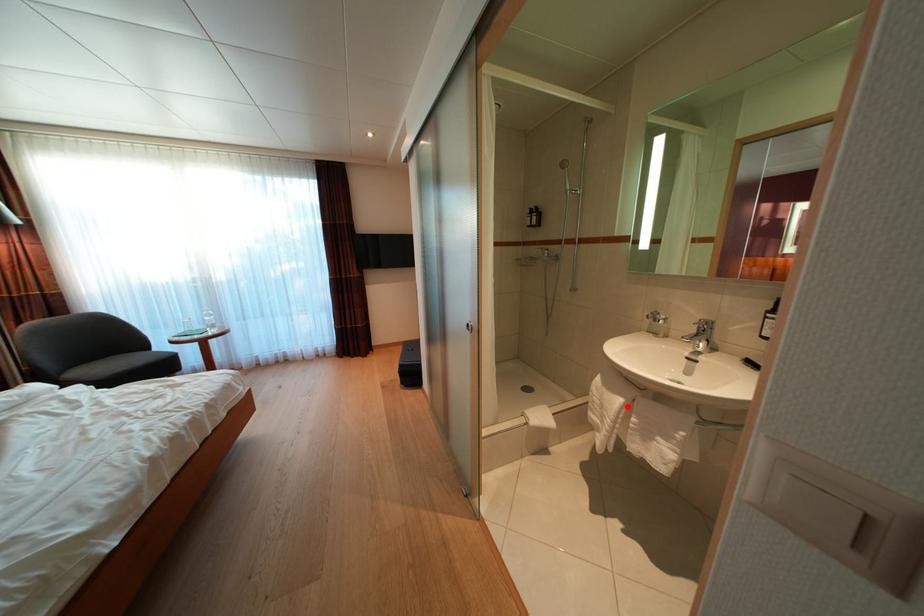
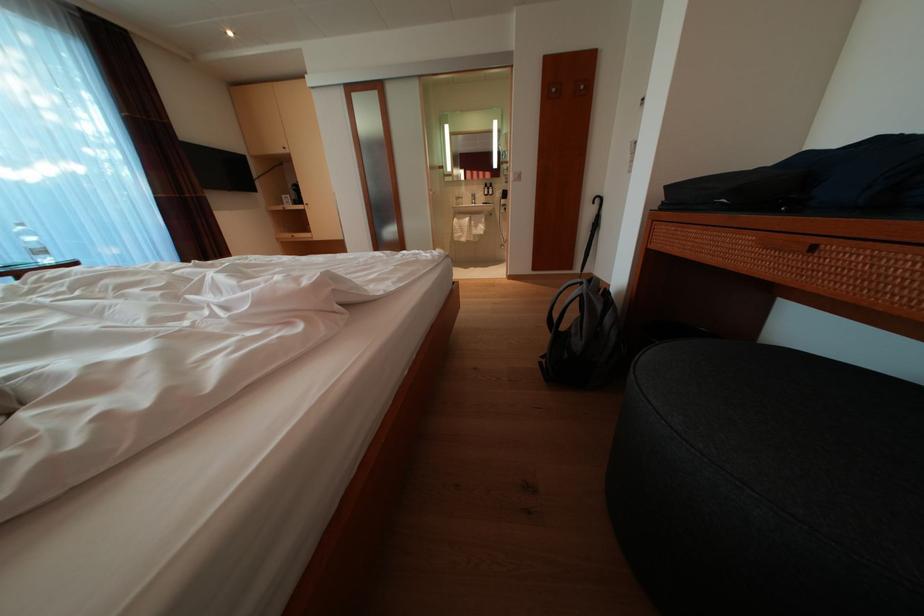
Question: I am providing you with two images of the same scene from different viewpoints. In image1, a red point is highlighted. Considering the same 3D point in image2, which of the following is correct?

Choices:
 (A) It is closer
 (B) It is farther

Answer: (A)